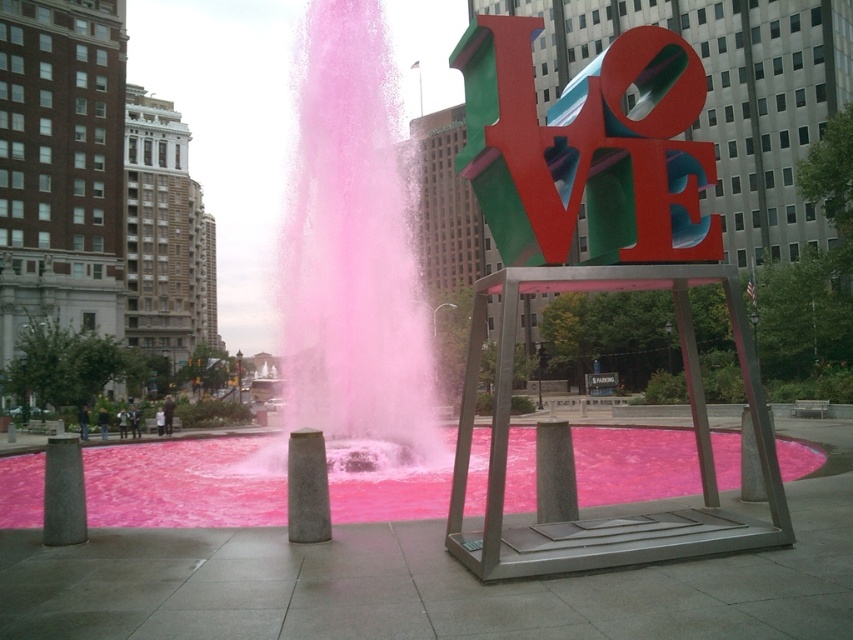
You are taking a photo of the fountain and the sculpture. You notice two points in the image labeled as point (612,74) and point (308,524). Which point will appear larger in your photo?

Point (612,74) is closer to the camera than point (308,524), so it will appear larger in the photo.

You are a photographer standing at point (595, 266). You want to capture the fountain and the sculpture in your shot. Which direction should you move to get both the fountain and the sculpture in frame?

The multicolored metallic sculpture at center is located at point (595, 266). To capture both the fountain and the sculpture, you should move towards the center of the fountain where the water jets converge, as the sculpture is already positioned centrally in the scene.